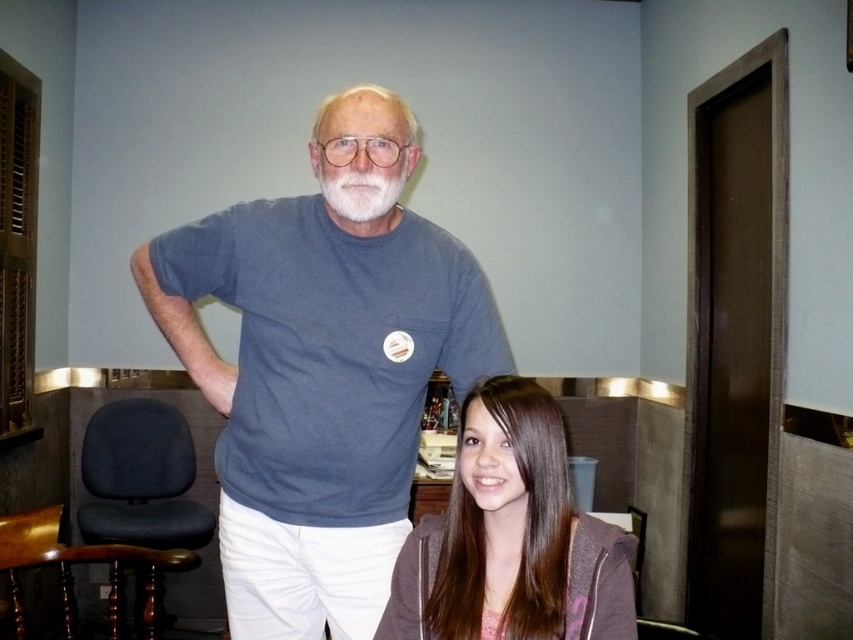
Question: Is matte blue t-shirt at center to the right of smooth brown hair at lower center from the viewer's perspective?

Choices:
 (A) yes
 (B) no

Answer: (B)

Question: Can you confirm if matte blue t-shirt at center is positioned below white matte beard at upper center?

Choices:
 (A) no
 (B) yes

Answer: (B)

Question: Which of the following is the closest to the observer?

Choices:
 (A) smooth brown hair at lower center
 (B) white matte beard at upper center

Answer: (A)

Question: Which of these objects is positioned closest to the smooth brown hair at lower center?

Choices:
 (A) matte blue t-shirt at center
 (B) white matte beard at upper center

Answer: (A)

Question: Is the position of matte blue t-shirt at center less distant than that of smooth brown hair at lower center?

Choices:
 (A) yes
 (B) no

Answer: (B)

Question: Which is nearer to the white matte beard at upper center?

Choices:
 (A) smooth brown hair at lower center
 (B) matte blue t-shirt at center

Answer: (B)